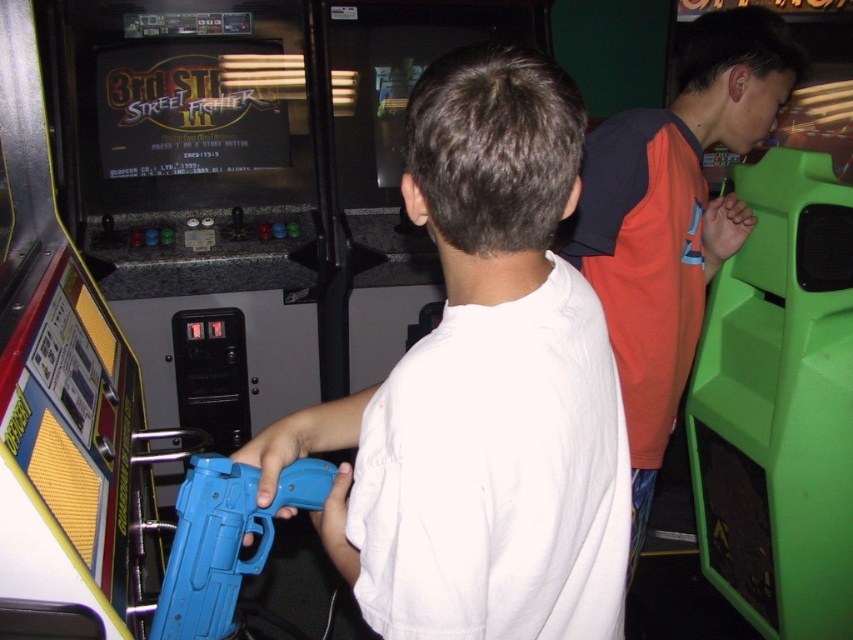
You are an arcade attendant and need to place a 12 inch wide advertisement between the orange jersey at right and the blue plastic toy gun at center. Can you fit it without overlapping either object?

The orange jersey at right and blue plastic toy gun at center are 30.32 inches apart. Since the advertisement is 12 inches wide, there is enough space between them to place it without overlapping either object.